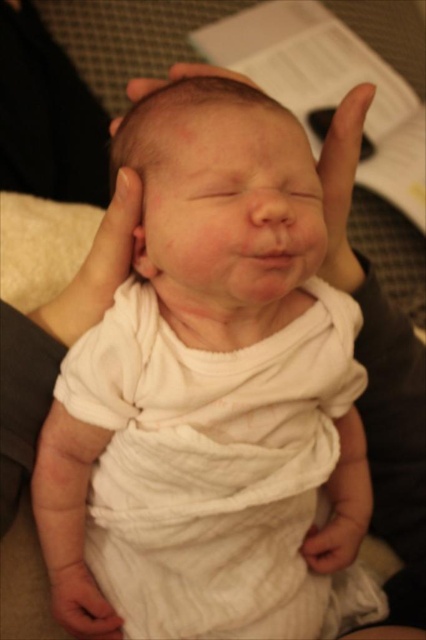
You are a healthcare professional checking the baby in the image. You need to ensure the cloth is large enough to fully cover the baby. Based on the image, do you think the white soft cloth at lower center can fully cover the white cotton baby at center?

The white cotton baby at center might be wider than white soft cloth at lower center, so the cloth may not be large enough to fully cover the baby.

You are a pediatric nurse examining the baby in the image. You need to check the baby for any visible marks on its skin. Which part of the baby should you focus on first, the white cotton baby at center or the smooth skin head at center?

You should focus on the smooth skin head at center first because the white cotton baby at center is closer to you, blocking your view of the smooth skin head at center which is behind it.